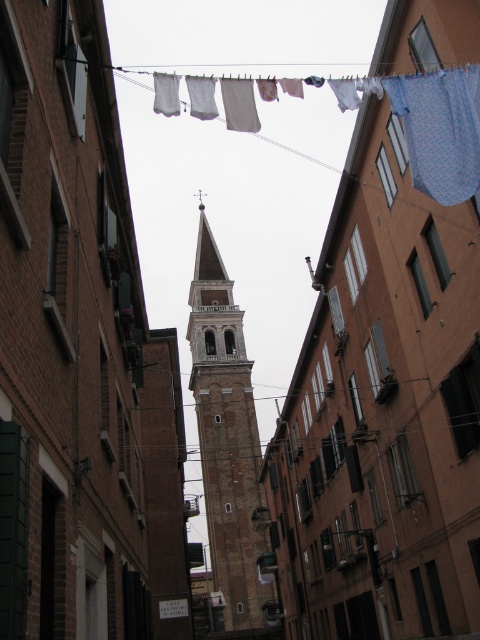
You are standing in the middle of the alleyway and see the point marked at coordinates (228, 445). What object is located at that point?

The point at coordinates (228, 445) corresponds to the light brown stone tower at center.

You are a delivery drone that needs to fly through this alleyway. There is a light brown stone tower at center and a blue printed fabric at upper right. Which object is taller, and will you need to adjust your flight path to avoid it?

The light brown stone tower at center is much taller than the blue printed fabric at upper right. Since the tower is taller, you should adjust your flight path to avoid it by flying lower to pass under the tower or higher to go over it, depending on the drone altitude restrictions.

You are a drone operator trying to fly a drone through this alleyway. The drone has a height limit of 1.2 meters. There is a light brown stone tower at center and a blue printed fabric at upper right in the image. Can the drone safely pass under both objects without hitting them?

The light brown stone tower at center is further to the viewer than the blue printed fabric at upper right. Since the tower is closer, the drone would first encounter it. However, the description does not provide specific height measurements for either object. Without knowing their exact heights, it is impossible to determine if the drone can safely pass under both objects within the 1.2 meter limit.